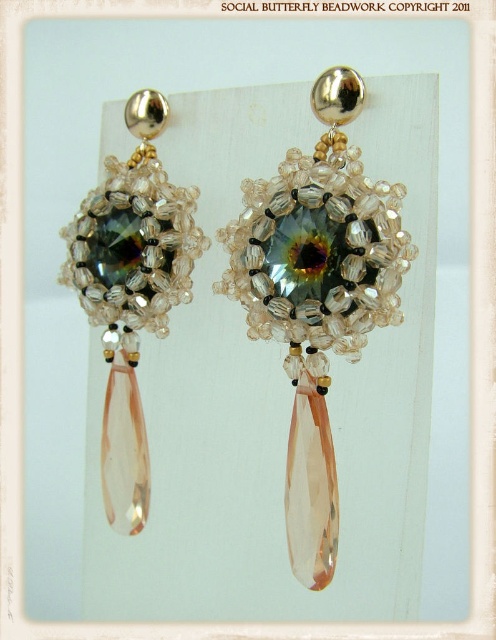
Can you confirm if matte glass earring at center is wider than matte silver beadwork at left?

Correct, the width of matte glass earring at center exceeds that of matte silver beadwork at left.

Consider the image. Between matte glass earring at center and matte silver beadwork at left, which one appears on the left side from the viewer's perspective?

matte silver beadwork at left

At what (x,y) coordinates should I click in order to perform the action: click on matte glass earring at center. Please return your answer as a coordinate pair (x, y). Looking at the image, I should click on (317, 296).